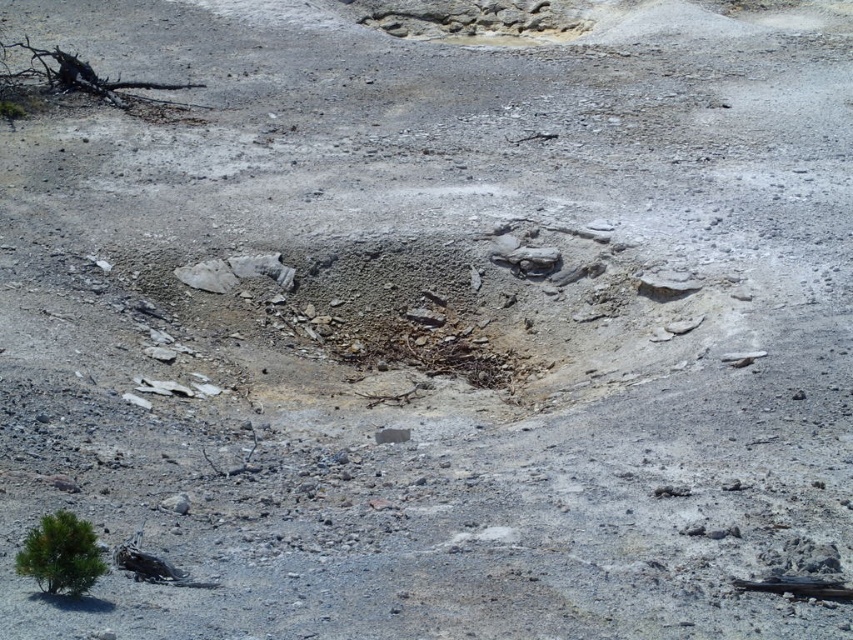
Question: Which of the following is the closest to the observer?

Choices:
 (A) (20, 554)
 (B) (33, 76)

Answer: (A)

Question: Observing the image, what is the correct spatial positioning of green matte tree at lower left in reference to black charred wood at upper left?

Choices:
 (A) left
 (B) right

Answer: (B)

Question: Can you confirm if green matte tree at lower left is positioned below black charred wood at upper left?

Choices:
 (A) yes
 (B) no

Answer: (A)

Question: Among these objects, which one is farthest from the camera?

Choices:
 (A) black charred wood at upper left
 (B) green matte tree at lower left

Answer: (A)

Question: Is green matte tree at lower left bigger than black charred wood at upper left?

Choices:
 (A) yes
 (B) no

Answer: (B)